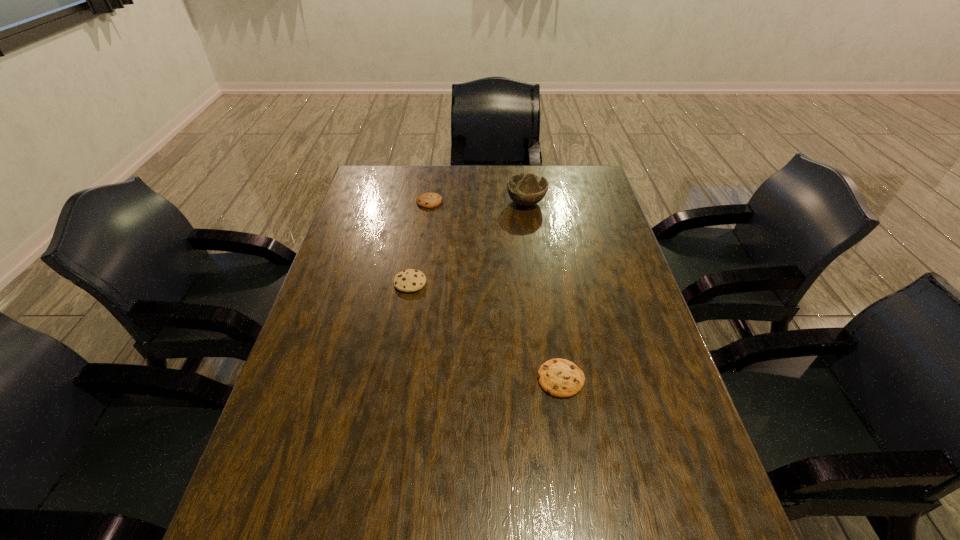
Find the location of a particular element. free space located on the left of the shortest object is located at coordinates (407, 379).

Where is `bowl positioned at the far edge`? The height and width of the screenshot is (540, 960). bowl positioned at the far edge is located at coordinates (526, 189).

You are a GUI agent. You are given a task and a screenshot of the screen. Output one action in this format:
    pyautogui.click(x=<x>, y=<y>)
    Task: Click on the cookie present at the far edge
    
    Given the screenshot: What is the action you would take?
    pyautogui.click(x=426, y=200)

In the image, there is a desktop. Identify the location of vacant region at the far edge. This screenshot has width=960, height=540. (501, 167).

This screenshot has width=960, height=540. In the image, there is a desktop. Find the location of `vacant space at the left edge`. vacant space at the left edge is located at coordinates (245, 534).

Where is `vacant space at the right edge of the desktop`? vacant space at the right edge of the desktop is located at coordinates (617, 294).

You are a GUI agent. You are given a task and a screenshot of the screen. Output one action in this format:
    pyautogui.click(x=<x>, y=<y>)
    Task: Click on the vacant space at the far left corner of the desktop
    
    Given the screenshot: What is the action you would take?
    pyautogui.click(x=358, y=185)

Find the location of a particular element. This screenshot has width=960, height=540. unoccupied position between the third farthest object and the tallest object is located at coordinates (468, 242).

I want to click on free space between the third tallest object and the tallest object, so click(x=478, y=202).

Where is `empty space that is in between the second tallest cookie and the tallest object`? This screenshot has height=540, width=960. empty space that is in between the second tallest cookie and the tallest object is located at coordinates (478, 202).